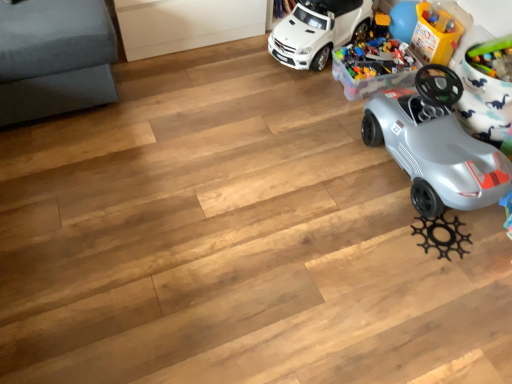
At what (x,y) coordinates should I click in order to perform the action: click on translucent plastic container at upper right, marked as the second toy in a right-to-left arrangement. Please return your answer as a coordinate pair (x, y). The height and width of the screenshot is (384, 512). Looking at the image, I should click on (370, 78).

How much space does white matte toy car at upper center, which is the 2th car in bottom-to-top order, occupy vertically?

15.51 inches.

This screenshot has height=384, width=512. I want to click on white matte toy car at upper center, which is the 2th car in bottom-to-top order, so click(x=318, y=31).

Measure the distance between silver metallic car at right, positioned as the 1th car in bottom-to-top order, and camera.

The depth of silver metallic car at right, positioned as the 1th car in bottom-to-top order, is 1.47 meters.

Describe the element at coordinates (436, 145) in the screenshot. I see `silver metallic car at right, positioned as the 1th car in bottom-to-top order` at that location.

The width and height of the screenshot is (512, 384). What do you see at coordinates (435, 34) in the screenshot?
I see `translucent plastic toy at upper right, the 2th toy in the left-to-right sequence` at bounding box center [435, 34].

At what (x,y) coordinates should I click in order to perform the action: click on translucent plastic container at upper right, marked as the second toy in a right-to-left arrangement. Please return your answer as a coordinate pair (x, y). Image resolution: width=512 pixels, height=384 pixels. Looking at the image, I should click on (370, 78).

Considering the relative positions of translucent plastic container at upper right, the 1th toy in the left-to-right sequence, and translucent plastic toy at upper right, the 2th toy in the left-to-right sequence, in the image provided, is translucent plastic container at upper right, the 1th toy in the left-to-right sequence, in front of translucent plastic toy at upper right, the 2th toy in the left-to-right sequence,?

Yes, it is in front of translucent plastic toy at upper right, the 2th toy in the left-to-right sequence.

In the scene shown: Is translucent plastic container at upper right, the 1th toy in the left-to-right sequence, not near translucent plastic toy at upper right, positioned as the 1th toy in right-to-left order?

No, translucent plastic container at upper right, the 1th toy in the left-to-right sequence, is not far away from translucent plastic toy at upper right, positioned as the 1th toy in right-to-left order.

Is translucent plastic container at upper right, the 1th toy in the left-to-right sequence, not inside translucent plastic toy at upper right, positioned as the 1th toy in right-to-left order?

Indeed, translucent plastic container at upper right, the 1th toy in the left-to-right sequence, is completely outside translucent plastic toy at upper right, positioned as the 1th toy in right-to-left order.

How distant is silver metallic car at right, positioned as the 1th car in bottom-to-top order, from white matte toy car at upper center, which is the 2th car in bottom-to-top order?

silver metallic car at right, positioned as the 1th car in bottom-to-top order, is 28.56 inches away from white matte toy car at upper center, which is the 2th car in bottom-to-top order.

From a real-world perspective, relative to white matte toy car at upper center, the 1th car in the top-to-bottom sequence, is silver metallic car at right, which appears as the 2th car when viewed from the top, vertically above or below?

Clearly, from a real-world perspective, silver metallic car at right, which appears as the 2th car when viewed from the top, is below white matte toy car at upper center, the 1th car in the top-to-bottom sequence.

Based on the photo, between silver metallic car at right, positioned as the 1th car in bottom-to-top order, and white matte toy car at upper center, which is the 2th car in bottom-to-top order, which one is positioned behind?

white matte toy car at upper center, which is the 2th car in bottom-to-top order, is further from the camera.

Identify the location of car that is on the left side of silver metallic car at right, positioned as the 1th car in bottom-to-top order. (318, 31).

Between translucent plastic toy at upper right, positioned as the 1th toy in right-to-left order, and white matte toy car at upper center, which is the 2th car in bottom-to-top order, which one has more height?

white matte toy car at upper center, which is the 2th car in bottom-to-top order.

How different are the orientations of translucent plastic toy at upper right, positioned as the 1th toy in right-to-left order, and white matte toy car at upper center, which is the 2th car in bottom-to-top order, in degrees?

21.9 degrees.

Can you confirm if translucent plastic toy at upper right, the 2th toy in the left-to-right sequence, is positioned to the left of white matte toy car at upper center, the 1th car in the top-to-bottom sequence?

No.

Can you confirm if translucent plastic toy at upper right, positioned as the 1th toy in right-to-left order, is smaller than white matte toy car at upper center, the 1th car in the top-to-bottom sequence?

Yes.

Can you confirm if silver metallic car at right, which appears as the 2th car when viewed from the top, is thinner than translucent plastic toy at upper right, the 2th toy in the left-to-right sequence?

Incorrect, the width of silver metallic car at right, which appears as the 2th car when viewed from the top, is not less than that of translucent plastic toy at upper right, the 2th toy in the left-to-right sequence.

From a real-world perspective, does silver metallic car at right, which appears as the 2th car when viewed from the top, stand above translucent plastic toy at upper right, the 2th toy in the left-to-right sequence?

Yes, from a real-world perspective, silver metallic car at right, which appears as the 2th car when viewed from the top, is above translucent plastic toy at upper right, the 2th toy in the left-to-right sequence.

Is silver metallic car at right, positioned as the 1th car in bottom-to-top order, inside or outside of translucent plastic toy at upper right, positioned as the 1th toy in right-to-left order?

silver metallic car at right, positioned as the 1th car in bottom-to-top order, is not enclosed by translucent plastic toy at upper right, positioned as the 1th toy in right-to-left order.

Find the location of `the 1st toy to the right of the white matte toy car at upper center, the 1th car in the top-to-bottom sequence, counting from the anchor's position`. the 1st toy to the right of the white matte toy car at upper center, the 1th car in the top-to-bottom sequence, counting from the anchor's position is located at coordinates (370, 78).

How far apart are translucent plastic container at upper right, marked as the second toy in a right-to-left arrangement, and white matte toy car at upper center, which is the 2th car in bottom-to-top order?

translucent plastic container at upper right, marked as the second toy in a right-to-left arrangement, is 8.91 inches from white matte toy car at upper center, which is the 2th car in bottom-to-top order.

From the image's perspective, which is above, translucent plastic container at upper right, the 1th toy in the left-to-right sequence, or white matte toy car at upper center, which is the 2th car in bottom-to-top order?

white matte toy car at upper center, which is the 2th car in bottom-to-top order, from the image's perspective.

Is translucent plastic container at upper right, marked as the second toy in a right-to-left arrangement, oriented away from white matte toy car at upper center, the 1th car in the top-to-bottom sequence?

No.

What's the angular difference between white matte toy car at upper center, the 1th car in the top-to-bottom sequence, and silver metallic car at right, positioned as the 1th car in bottom-to-top order,'s facing directions?

The angle between the facing direction of white matte toy car at upper center, the 1th car in the top-to-bottom sequence, and the facing direction of silver metallic car at right, positioned as the 1th car in bottom-to-top order, is 21.9 degrees.

Which of these two, white matte toy car at upper center, which is the 2th car in bottom-to-top order, or silver metallic car at right, positioned as the 1th car in bottom-to-top order, is bigger?

silver metallic car at right, positioned as the 1th car in bottom-to-top order.

From a real-world perspective, is white matte toy car at upper center, which is the 2th car in bottom-to-top order, located beneath silver metallic car at right, which appears as the 2th car when viewed from the top?

No, from a real-world perspective, white matte toy car at upper center, which is the 2th car in bottom-to-top order, is not below silver metallic car at right, which appears as the 2th car when viewed from the top.

Between white matte toy car at upper center, the 1th car in the top-to-bottom sequence, and silver metallic car at right, positioned as the 1th car in bottom-to-top order, which one appears on the left side from the viewer's perspective?

white matte toy car at upper center, the 1th car in the top-to-bottom sequence, is more to the left.

Is translucent plastic toy at upper right, positioned as the 1th toy in right-to-left order, not within translucent plastic container at upper right, marked as the second toy in a right-to-left arrangement?

Yes, translucent plastic toy at upper right, positioned as the 1th toy in right-to-left order, is outside of translucent plastic container at upper right, marked as the second toy in a right-to-left arrangement.

Does point (443, 11) come farther from viewer compared to point (332, 61)?

Yes, it is.

Can you confirm if translucent plastic toy at upper right, the 2th toy in the left-to-right sequence, is shorter than translucent plastic container at upper right, marked as the second toy in a right-to-left arrangement?

In fact, translucent plastic toy at upper right, the 2th toy in the left-to-right sequence, may be taller than translucent plastic container at upper right, marked as the second toy in a right-to-left arrangement.

Can you confirm if translucent plastic toy at upper right, positioned as the 1th toy in right-to-left order, is positioned to the right of translucent plastic container at upper right, the 1th toy in the left-to-right sequence?

Indeed, translucent plastic toy at upper right, positioned as the 1th toy in right-to-left order, is positioned on the right side of translucent plastic container at upper right, the 1th toy in the left-to-right sequence.

At what (x,y) coordinates should I click in order to perform the action: click on toy below the translucent plastic toy at upper right, the 2th toy in the left-to-right sequence (from a real-world perspective). Please return your answer as a coordinate pair (x, y). This screenshot has height=384, width=512. Looking at the image, I should click on 370,78.

At what (x,y) coordinates should I click in order to perform the action: click on car that is above the silver metallic car at right, positioned as the 1th car in bottom-to-top order (from a real-world perspective). Please return your answer as a coordinate pair (x, y). Looking at the image, I should click on (318, 31).

Considering their positions, is silver metallic car at right, which appears as the 2th car when viewed from the top, positioned closer to translucent plastic container at upper right, the 1th toy in the left-to-right sequence, than white matte toy car at upper center, which is the 2th car in bottom-to-top order?

white matte toy car at upper center, which is the 2th car in bottom-to-top order.

When comparing their distances from silver metallic car at right, which appears as the 2th car when viewed from the top, does white matte toy car at upper center, which is the 2th car in bottom-to-top order, or translucent plastic toy at upper right, the 2th toy in the left-to-right sequence, seem further?

white matte toy car at upper center, which is the 2th car in bottom-to-top order, is positioned further to the anchor silver metallic car at right, which appears as the 2th car when viewed from the top.

When comparing their distances from white matte toy car at upper center, the 1th car in the top-to-bottom sequence, does translucent plastic container at upper right, marked as the second toy in a right-to-left arrangement, or translucent plastic toy at upper right, positioned as the 1th toy in right-to-left order, seem closer?

translucent plastic container at upper right, marked as the second toy in a right-to-left arrangement, is closer to white matte toy car at upper center, the 1th car in the top-to-bottom sequence.

From the image, which object appears to be nearer to white matte toy car at upper center, which is the 2th car in bottom-to-top order, silver metallic car at right, positioned as the 1th car in bottom-to-top order, or translucent plastic toy at upper right, the 2th toy in the left-to-right sequence?

Based on the image, translucent plastic toy at upper right, the 2th toy in the left-to-right sequence, appears to be nearer to white matte toy car at upper center, which is the 2th car in bottom-to-top order.

Based on their spatial positions, is translucent plastic container at upper right, the 1th toy in the left-to-right sequence, or silver metallic car at right, positioned as the 1th car in bottom-to-top order, closer to translucent plastic toy at upper right, positioned as the 1th toy in right-to-left order?

Based on the image, translucent plastic container at upper right, the 1th toy in the left-to-right sequence, appears to be nearer to translucent plastic toy at upper right, positioned as the 1th toy in right-to-left order.

Estimate the real-world distances between objects in this image. Which object is further from translucent plastic toy at upper right, positioned as the 1th toy in right-to-left order, silver metallic car at right, which appears as the 2th car when viewed from the top, or white matte toy car at upper center, which is the 2th car in bottom-to-top order?

silver metallic car at right, which appears as the 2th car when viewed from the top, is positioned further to the anchor translucent plastic toy at upper right, positioned as the 1th toy in right-to-left order.

Considering their positions, is translucent plastic toy at upper right, positioned as the 1th toy in right-to-left order, positioned closer to white matte toy car at upper center, which is the 2th car in bottom-to-top order, than silver metallic car at right, which appears as the 2th car when viewed from the top?

translucent plastic toy at upper right, positioned as the 1th toy in right-to-left order, lies closer to white matte toy car at upper center, which is the 2th car in bottom-to-top order, than the other object.

When comparing their distances from translucent plastic container at upper right, marked as the second toy in a right-to-left arrangement, does white matte toy car at upper center, the 1th car in the top-to-bottom sequence, or silver metallic car at right, positioned as the 1th car in bottom-to-top order, seem further?

The object further to translucent plastic container at upper right, marked as the second toy in a right-to-left arrangement, is silver metallic car at right, positioned as the 1th car in bottom-to-top order.

Locate an element on the screen. The height and width of the screenshot is (384, 512). toy positioned between silver metallic car at right, which appears as the 2th car when viewed from the top, and translucent plastic toy at upper right, the 2th toy in the left-to-right sequence, from near to far is located at coordinates (370, 78).

The width and height of the screenshot is (512, 384). Identify the location of car positioned between silver metallic car at right, which appears as the 2th car when viewed from the top, and translucent plastic toy at upper right, the 2th toy in the left-to-right sequence, from near to far. (318, 31).

The image size is (512, 384). Identify the location of car between silver metallic car at right, which appears as the 2th car when viewed from the top, and translucent plastic container at upper right, the 1th toy in the left-to-right sequence, from front to back. (318, 31).

At what (x,y) coordinates should I click in order to perform the action: click on toy situated between white matte toy car at upper center, which is the 2th car in bottom-to-top order, and translucent plastic toy at upper right, positioned as the 1th toy in right-to-left order, from left to right. Please return your answer as a coordinate pair (x, y). Looking at the image, I should click on (370, 78).